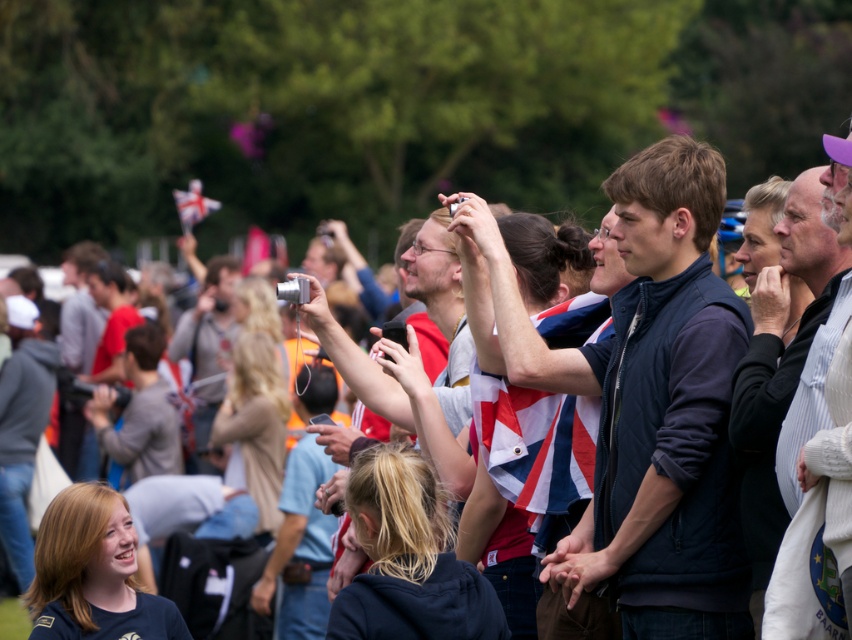
Between white fabric flag at upper center and red fabric flag at center, which one has less height?

red fabric flag at center

Which is above, white fabric flag at upper center or red fabric flag at center?

Positioned higher is white fabric flag at upper center.

Is point (191, 204) more distant than point (262, 244)?

No, (191, 204) is in front of (262, 244).

Locate an element on the screen. Image resolution: width=852 pixels, height=640 pixels. white fabric flag at upper center is located at coordinates (193, 204).